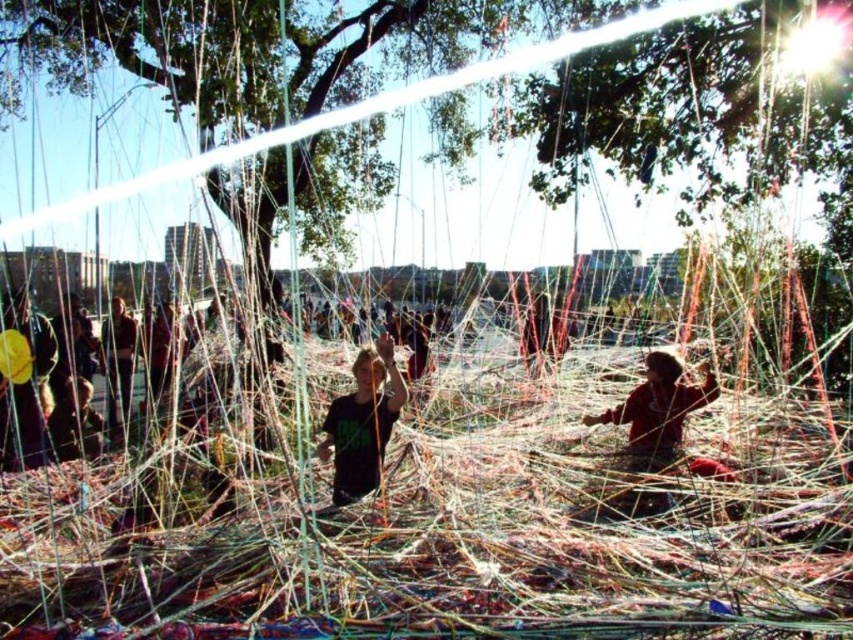
Question: Does matte black shirt at center have a smaller size compared to red fabric child at lower right?

Choices:
 (A) yes
 (B) no

Answer: (A)

Question: Is matte black shirt at center positioned at the back of red fabric child at lower right?

Choices:
 (A) yes
 (B) no

Answer: (B)

Question: Does matte black shirt at center have a greater width compared to red fabric child at lower right?

Choices:
 (A) yes
 (B) no

Answer: (B)

Question: Among these points, which one is nearest to the camera?

Choices:
 (A) (650, 376)
 (B) (357, 358)

Answer: (A)

Question: Which of the following is the farthest from the observer?

Choices:
 (A) red fabric child at lower right
 (B) matte black shirt at center

Answer: (A)